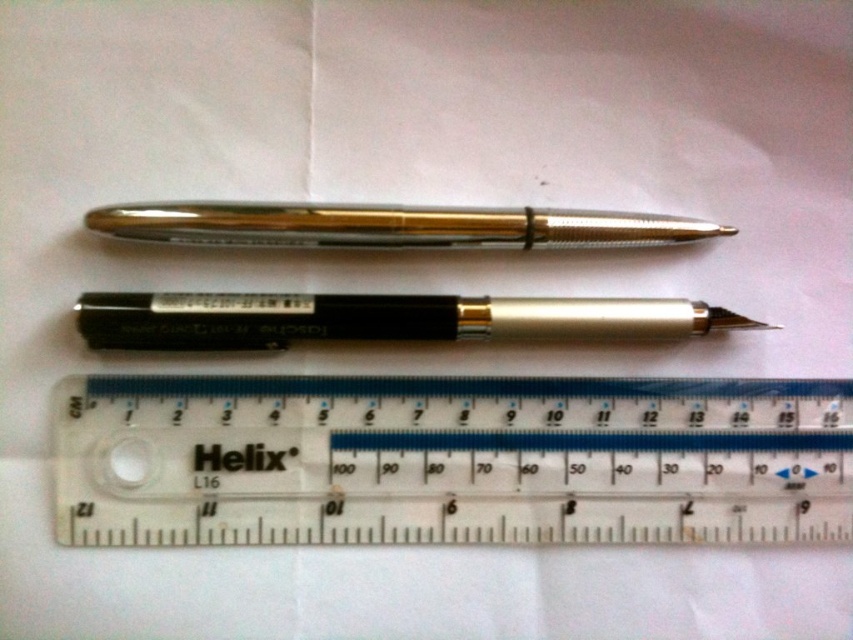
Between transparent plastic ruler at center and black metallic pen at center, which one appears on the right side from the viewer's perspective?

Positioned to the right is transparent plastic ruler at center.

This screenshot has width=853, height=640. I want to click on transparent plastic ruler at center, so click(x=444, y=465).

Where is `transparent plastic ruler at center`? This screenshot has width=853, height=640. transparent plastic ruler at center is located at coordinates (444, 465).

Measure the distance between point (450, 328) and camera.

Point (450, 328) and camera are 1.28 meters apart from each other.

Can you confirm if black metallic pen at center is positioned to the right of gold metallic pen at center?

Correct, you'll find black metallic pen at center to the right of gold metallic pen at center.

Identify the location of black metallic pen at center. (376, 317).

Between transparent plastic ruler at center and gold metallic pen at center, which one has less height?

gold metallic pen at center

Between transparent plastic ruler at center and gold metallic pen at center, which one is positioned lower?

transparent plastic ruler at center is below.

Locate an element on the screen. This screenshot has height=640, width=853. transparent plastic ruler at center is located at coordinates (444, 465).